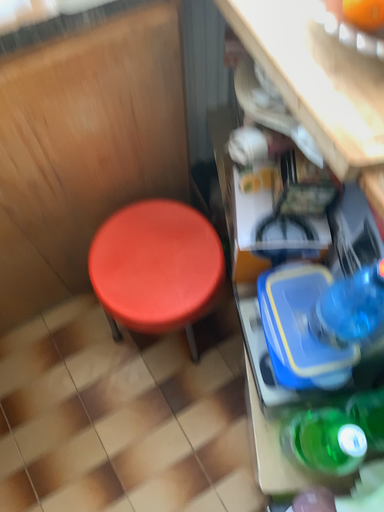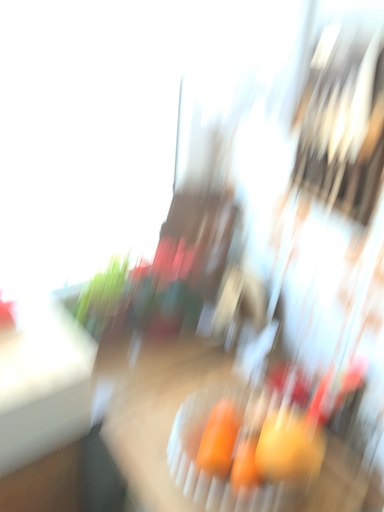
Question: How did the camera likely rotate when shooting the video?

Choices:
 (A) rotated downward
 (B) rotated upward

Answer: (B)